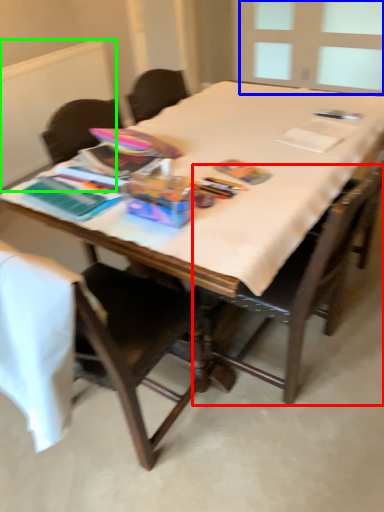
Question: Considering the real-world distances, which object is closest to chair (highlighted by a red box)? window screen (highlighted by a blue box) or radiator (highlighted by a green box).

Choices:
 (A) window screen
 (B) radiator

Answer: (B)